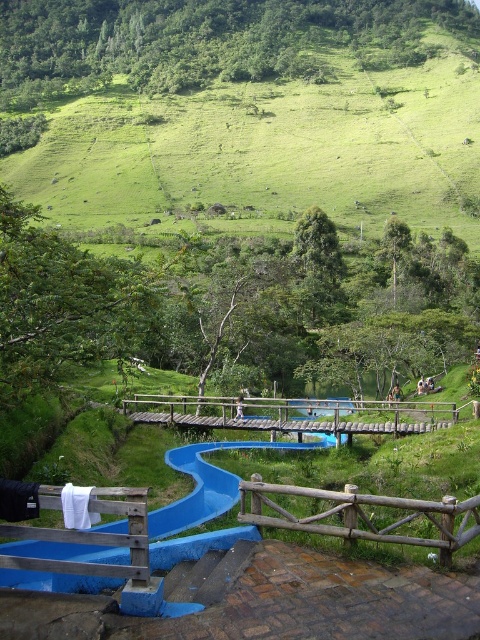
Question: Is blue plastic slide at center below brown wooden fence at lower center?

Choices:
 (A) yes
 (B) no

Answer: (A)

Question: Where is blue plastic slide at center located in relation to brown wooden fence at lower center in the image?

Choices:
 (A) left
 (B) right

Answer: (A)

Question: Which of the following is the closest to the observer?

Choices:
 (A) (342, 404)
 (B) (228, 472)

Answer: (B)

Question: Is blue plastic slide at center below wooden bridge at center?

Choices:
 (A) yes
 (B) no

Answer: (B)

Question: Which of the following is the closest to the observer?

Choices:
 (A) (243, 522)
 (B) (184, 557)
 (C) (282, 419)

Answer: (B)

Question: Among these points, which one is farthest from the camera?

Choices:
 (A) pyautogui.click(x=300, y=408)
 (B) pyautogui.click(x=441, y=509)

Answer: (A)